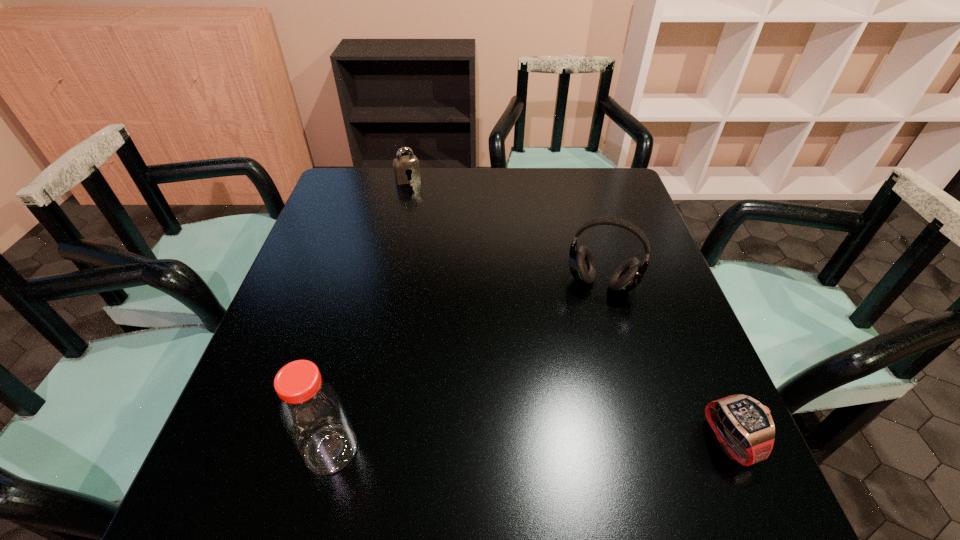
Find the location of a particular element. The height and width of the screenshot is (540, 960). vacant space positioned on the ear cups of the headset is located at coordinates (588, 319).

The image size is (960, 540). What are the coordinates of `vacant region located on the ear cups of the headset` in the screenshot? It's located at (557, 422).

Identify the location of vacant area situated at the front of the second shortest object near the keyhole. The image size is (960, 540). (419, 194).

The width and height of the screenshot is (960, 540). Find the location of `free point located at the front of the second shortest object near the keyhole`. free point located at the front of the second shortest object near the keyhole is located at coordinates (430, 213).

This screenshot has width=960, height=540. Identify the location of vacant space located at the front of the second shortest object near the keyhole. (421, 199).

I want to click on object that is at the far edge, so click(x=406, y=167).

This screenshot has width=960, height=540. Find the location of `bottle located in the near edge section of the desktop`. bottle located in the near edge section of the desktop is located at coordinates (312, 412).

The height and width of the screenshot is (540, 960). What are the coordinates of `watch that is at the near edge` in the screenshot? It's located at (744, 427).

Where is `object present at the left edge`? This screenshot has height=540, width=960. object present at the left edge is located at coordinates (312, 412).

In order to click on watch that is positioned at the right edge in this screenshot , I will do `click(744, 427)`.